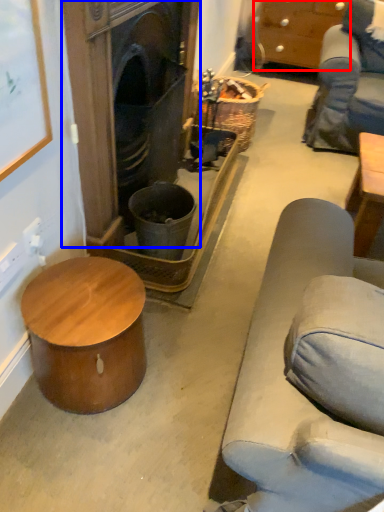
Question: Which point is further to the camera, cabinetry (highlighted by a red box) or fireplace (highlighted by a blue box)?

Choices:
 (A) cabinetry
 (B) fireplace

Answer: (A)